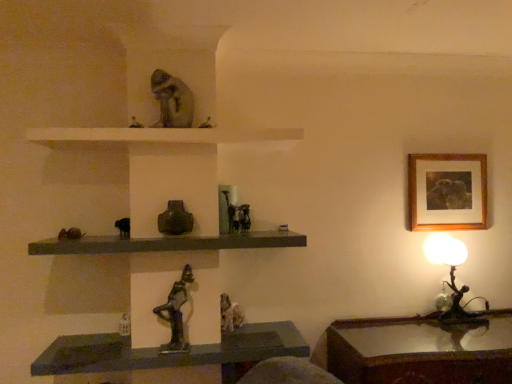
Question: Is metallic statue at center placed right next to rustic stone figurine at center, the 1th animal when ordered from bottom to top?

Choices:
 (A) no
 (B) yes

Answer: (A)

Question: Considering the relative sizes of metallic statue at center and rustic stone figurine at center, the 1th animal when ordered from bottom to top, in the image provided, is metallic statue at center thinner than rustic stone figurine at center, the 1th animal when ordered from bottom to top,?

Choices:
 (A) no
 (B) yes

Answer: (A)

Question: Does metallic statue at center have a smaller size compared to rustic stone figurine at center, which is the 4th animal in top-to-bottom order?

Choices:
 (A) yes
 (B) no

Answer: (B)

Question: From the image's perspective, does metallic statue at center appear lower than rustic stone figurine at center, the 1th animal when ordered from bottom to top?

Choices:
 (A) yes
 (B) no

Answer: (A)

Question: Can you confirm if metallic statue at center is positioned to the right of rustic stone figurine at center, the 1th animal when ordered from bottom to top?

Choices:
 (A) yes
 (B) no

Answer: (B)

Question: From the image's perspective, is metallic bronze figurine at right positioned above or below wooden table at lower right?

Choices:
 (A) above
 (B) below

Answer: (A)

Question: From a real-world perspective, is metallic bronze figurine at right positioned above or below wooden table at lower right?

Choices:
 (A) below
 (B) above

Answer: (B)

Question: In terms of width, does metallic bronze figurine at right look wider or thinner when compared to wooden table at lower right?

Choices:
 (A) thin
 (B) wide

Answer: (A)

Question: Is metallic bronze figurine at right to the left or to the right of wooden table at lower right in the image?

Choices:
 (A) right
 (B) left

Answer: (A)

Question: From the image's perspective, is wooden table at lower right located above or below bronze statue at center, which is the 2th animal from bottom to top?

Choices:
 (A) below
 (B) above

Answer: (A)

Question: Is point (373, 357) closer or farther from the camera than point (176, 344)?

Choices:
 (A) farther
 (B) closer

Answer: (B)

Question: Is wooden table at lower right wider or thinner than bronze statue at center, positioned as the third animal in top-to-bottom order?

Choices:
 (A) wide
 (B) thin

Answer: (A)

Question: Considering the relative positions of wooden table at lower right and bronze statue at center, positioned as the third animal in top-to-bottom order, in the image provided, is wooden table at lower right to the left or to the right of bronze statue at center, positioned as the third animal in top-to-bottom order,?

Choices:
 (A) right
 (B) left

Answer: (A)

Question: Considering the positions of white matte shelf at upper center, the first shelf in the top-to-bottom sequence, and matte stone chameleon at upper center, which appears as the 4th animal when ordered from the bottom, in the image, is white matte shelf at upper center, the first shelf in the top-to-bottom sequence, taller or shorter than matte stone chameleon at upper center, which appears as the 4th animal when ordered from the bottom,?

Choices:
 (A) tall
 (B) short

Answer: (B)

Question: Which is correct: white matte shelf at upper center, the first shelf in the top-to-bottom sequence, is inside matte stone chameleon at upper center, the first animal viewed from the top, or outside of it?

Choices:
 (A) inside
 (B) outside

Answer: (B)